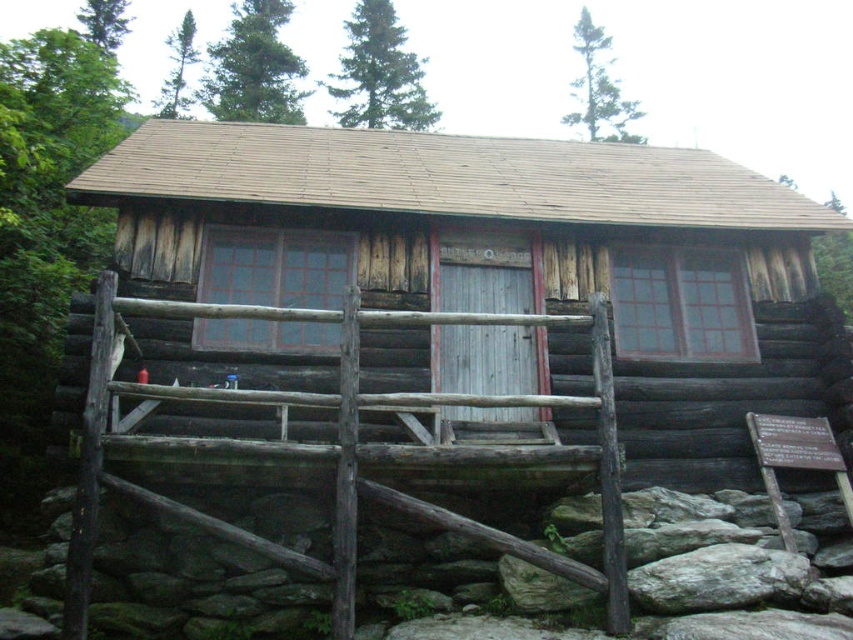
Is weathered wood railing at center wider than green textured pine tree at upper center?

No, weathered wood railing at center is not wider than green textured pine tree at upper center.

Can you confirm if weathered wood railing at center is bigger than green textured pine tree at upper center?

No, weathered wood railing at center is not bigger than green textured pine tree at upper center.

Is point (341, 541) farther from camera compared to point (573, 33)?

No, (341, 541) is closer to viewer.

You are a GUI agent. You are given a task and a screenshot of the screen. Output one action in this format:
    pyautogui.click(x=<x>, y=<y>)
    Task: Click on the weathered wood railing at center
    
    Given the screenshot: What is the action you would take?
    pyautogui.click(x=338, y=449)

Based on the photo, who is shorter, green coniferous tree at upper center or green leafy tree at upper left?

green leafy tree at upper left is shorter.

Based on the photo, measure the distance between green coniferous tree at upper center and camera.

green coniferous tree at upper center is 97.58 feet away from camera.

Who is more distant from viewer, (347, 28) or (115, 22)?

The point (347, 28) is behind.

At what (x,y) coordinates should I click in order to perform the action: click on green coniferous tree at upper center. Please return your answer as a coordinate pair (x, y). This screenshot has height=640, width=853. Looking at the image, I should click on (379, 74).

Who is taller, rustic wooden cabin at center or green coniferous tree at upper center?

With more height is green coniferous tree at upper center.

Does rustic wooden cabin at center have a lesser height compared to green coniferous tree at upper center?

Yes, rustic wooden cabin at center is shorter than green coniferous tree at upper center.

I want to click on rustic wooden cabin at center, so click(x=498, y=253).

Where is `rustic wooden cabin at center`? The width and height of the screenshot is (853, 640). rustic wooden cabin at center is located at coordinates (498, 253).